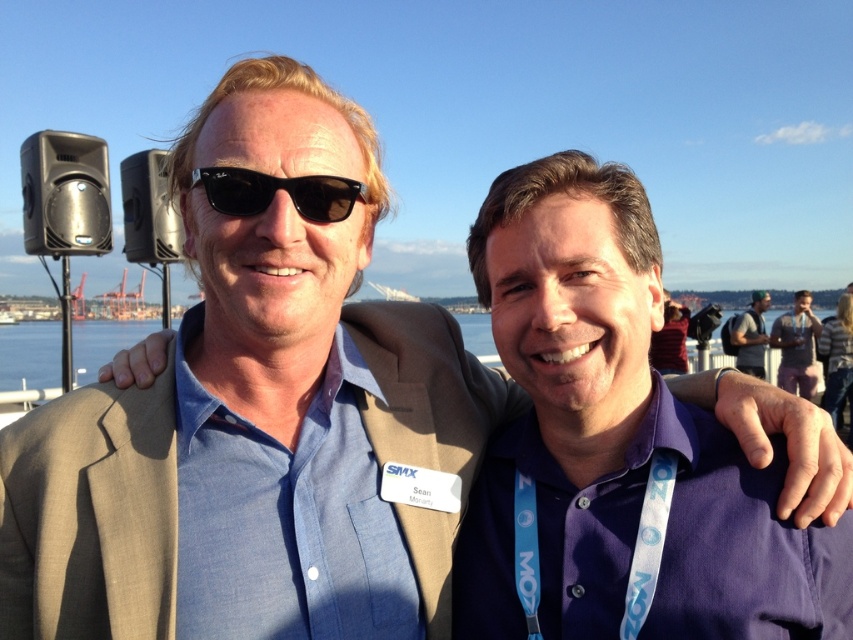
Question: Does pink fabric at center lie in front of gray fabric backpack at right?

Choices:
 (A) yes
 (B) no

Answer: (A)

Question: Does purple cotton shirt at center appear under black plastic sunglasses at center?

Choices:
 (A) yes
 (B) no

Answer: (A)

Question: Which object is positioned farthest from the pink fabric at center?

Choices:
 (A) purple cotton shirt at center
 (B) black plastic sunglasses at center
 (C) gray fabric backpack at right

Answer: (B)

Question: Is pink fabric at center positioned in front of gray fabric backpack at right?

Choices:
 (A) yes
 (B) no

Answer: (A)

Question: Which object is positioned farthest from the gray fabric backpack at right?

Choices:
 (A) black plastic sunglasses at center
 (B) purple cotton shirt at center
 (C) pink fabric at center

Answer: (A)

Question: Which point is closer to the camera?

Choices:
 (A) (314, 200)
 (B) (662, 436)

Answer: (A)